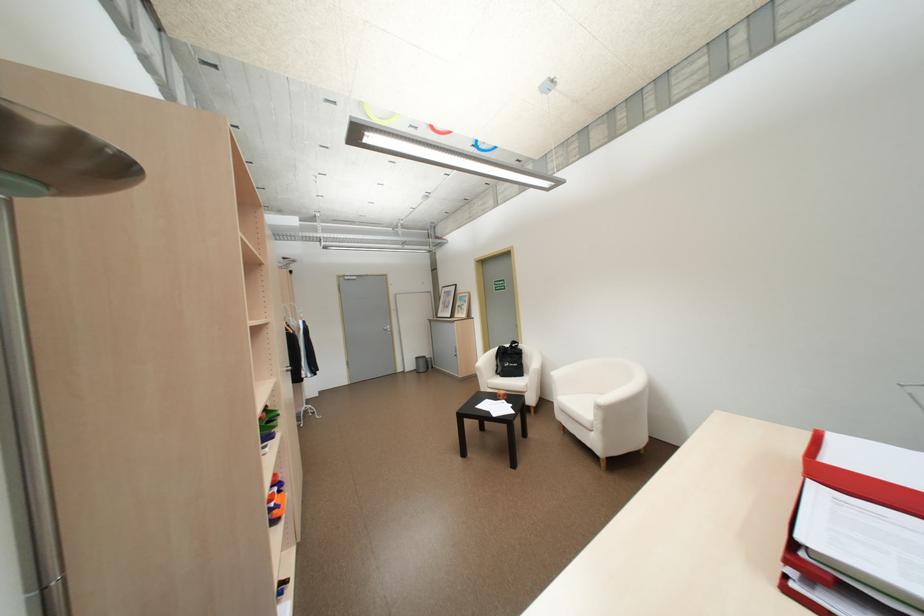
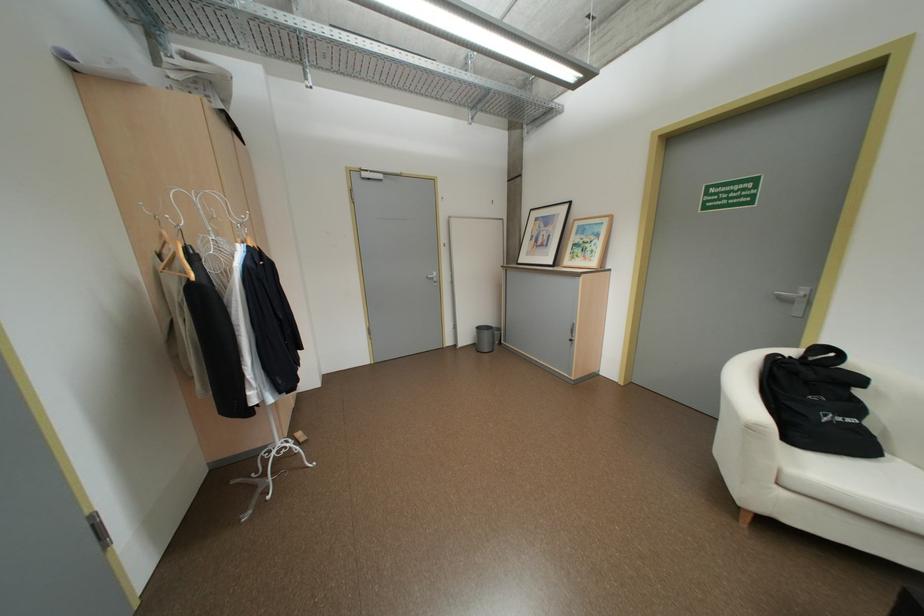
Locate, in the second image, the point that corresponds to point (419, 365) in the first image.

(476, 338)